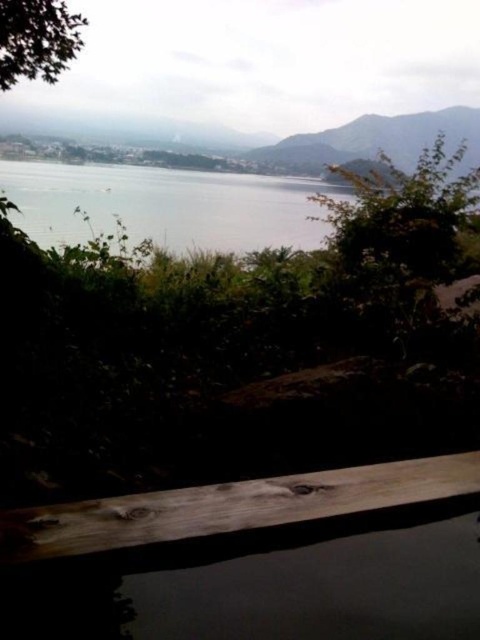
You are standing on a balcony and want to take a photo of the clear water at center without the brown wood rail at lower center blocking the view. Is the rail in the way of the water in the photo?

The brown wood rail at lower center is closer to the viewer than the clear water at center, so it will block the view of the clear water at center in the photo.

Looking at this image, you are standing at the wooden railing and see two points in the scene. The first point is labeled as point (119, 522) and the second is point (35, 224). Which point is closer to you?

Point (119, 522) is closer to you because it is in front of point (35, 224).